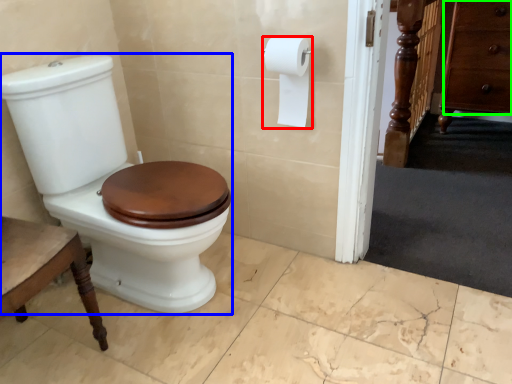
Question: Which is farther away from toilet paper (highlighted by a red box)? porcelain (highlighted by a blue box) or drawer (highlighted by a green box)?

Choices:
 (A) porcelain
 (B) drawer

Answer: (B)